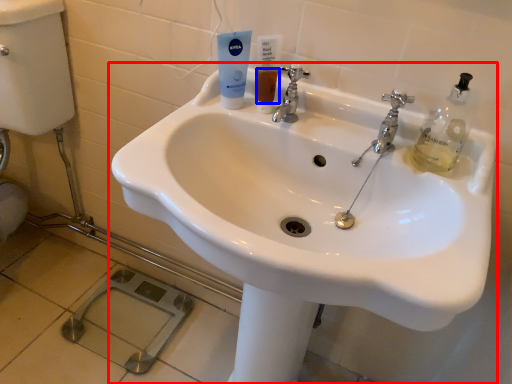
Question: Which object is closer to the camera taking this photo, sink (highlighted by a red box) or liquid (highlighted by a blue box)?

Choices:
 (A) sink
 (B) liquid

Answer: (A)